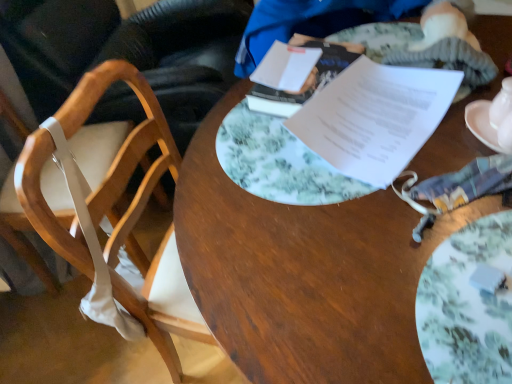
You are a GUI agent. You are given a task and a screenshot of the screen. Output one action in this format:
    pyautogui.click(x=<x>, y=<y>)
    Task: Click on the free space above wooden desk at center (from a real-world perspective)
    The width and height of the screenshot is (512, 384).
    Given the screenshot: What is the action you would take?
    pyautogui.click(x=375, y=181)